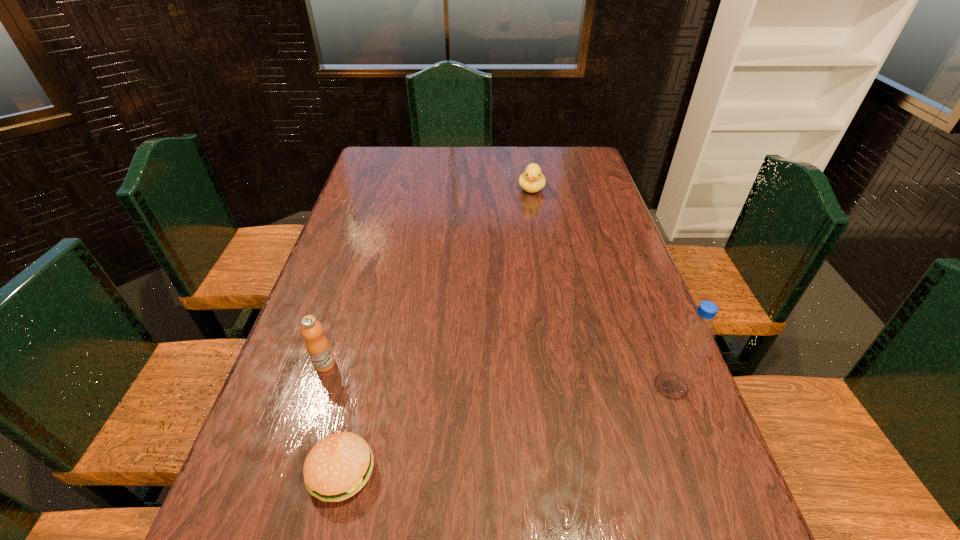
The image size is (960, 540). I want to click on object located in the near left corner section of the desktop, so click(339, 465).

In the image, there is a desktop. Where is `vacant space at the far edge`? The height and width of the screenshot is (540, 960). vacant space at the far edge is located at coordinates (510, 152).

Identify the location of free space at the near edge of the desktop. This screenshot has height=540, width=960. (635, 488).

Locate an element on the screen. The width and height of the screenshot is (960, 540). vacant region at the left edge is located at coordinates (346, 238).

This screenshot has width=960, height=540. Find the location of `vacant space at the right edge`. vacant space at the right edge is located at coordinates (615, 390).

Find the location of a particular element. free space at the far right corner is located at coordinates (577, 148).

Image resolution: width=960 pixels, height=540 pixels. I want to click on empty location between the patty and the rightmost object, so click(x=507, y=428).

You are a GUI agent. You are given a task and a screenshot of the screen. Output one action in this format:
    pyautogui.click(x=<x>, y=<y>)
    Task: Click on the blank region between the rightmost object and the second object from right to left
    The image size is (960, 540).
    Given the screenshot: What is the action you would take?
    pyautogui.click(x=602, y=287)

At what (x,y) coordinates should I click in order to perform the action: click on free space between the shortest object and the leftmost object. Please return your answer as a coordinate pair (x, y). Image resolution: width=960 pixels, height=540 pixels. Looking at the image, I should click on (333, 418).

The image size is (960, 540). Find the location of `vacant space that's between the third object from right to left and the water bottle`. vacant space that's between the third object from right to left and the water bottle is located at coordinates (507, 428).